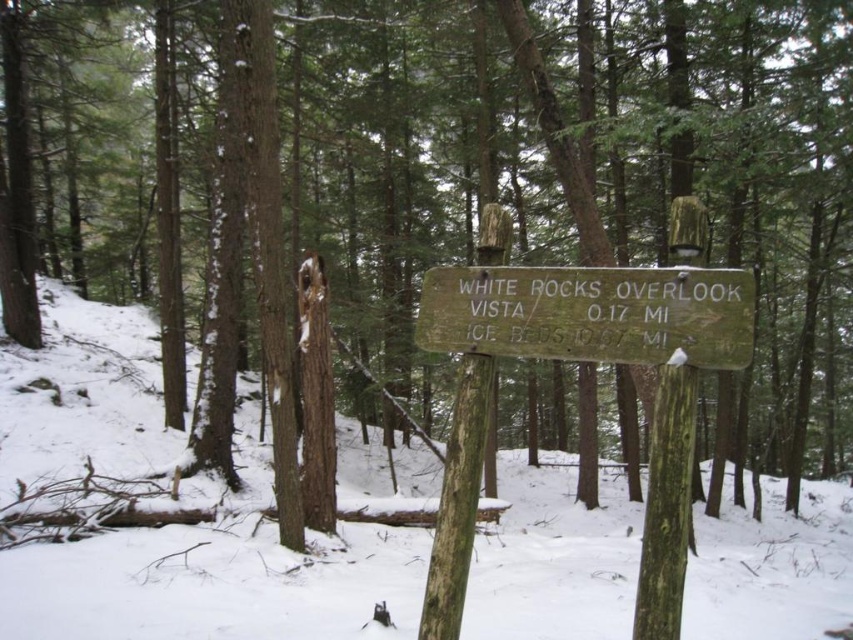
You are planning to walk from the weathered wood sign at center to the white matte snow at center. Considering their sizes, which object will you step onto first?

The weathered wood sign at center is smaller than the white matte snow at center, so you will step onto the weathered wood sign at center first before reaching the white matte snow at center.

You are standing at the wooden sign in the winter forest and want to walk to the point marked as point (177,582). Which direction should you head relative to the point (741,305)?

You should head towards the point (177,582), which is closer to you compared to the point (741,305). Since it is further away, the point (741,305) is behind the point (177,582) from your current position at the wooden sign.